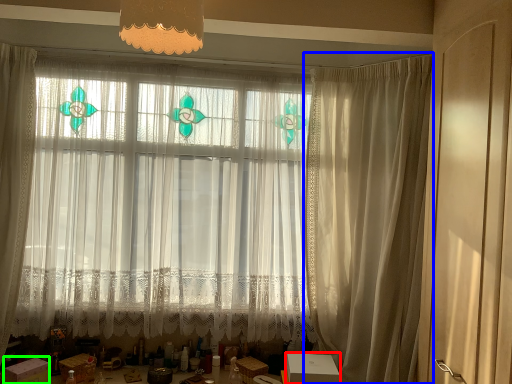
Question: Based on their relative distances, which object is farther from cardboard box (highlighted by a red box)? Choose from curtain (highlighted by a blue box) and cardboard box (highlighted by a green box).

Choices:
 (A) curtain
 (B) cardboard box

Answer: (B)